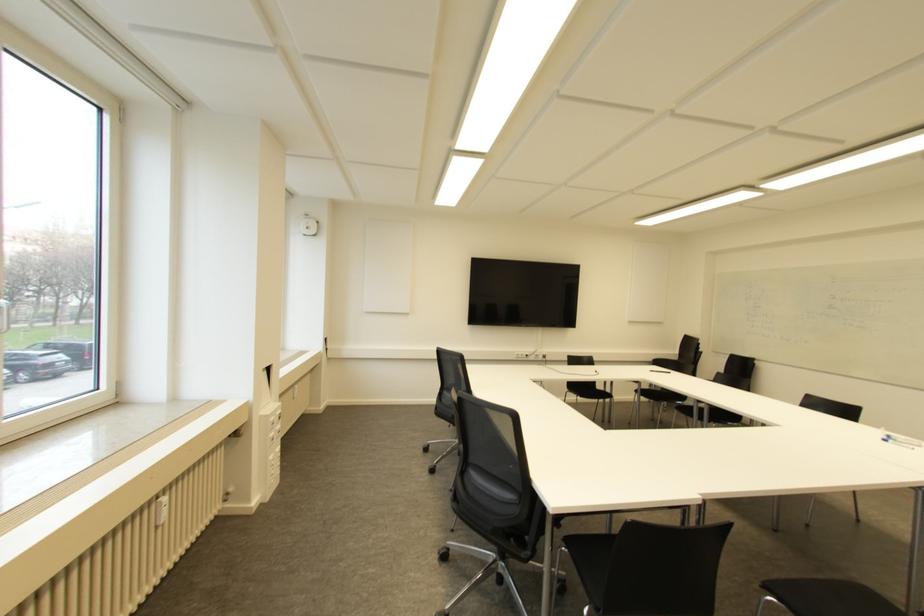
This screenshot has height=616, width=924. What do you see at coordinates (824, 596) in the screenshot?
I see `a black chair sitting surface` at bounding box center [824, 596].